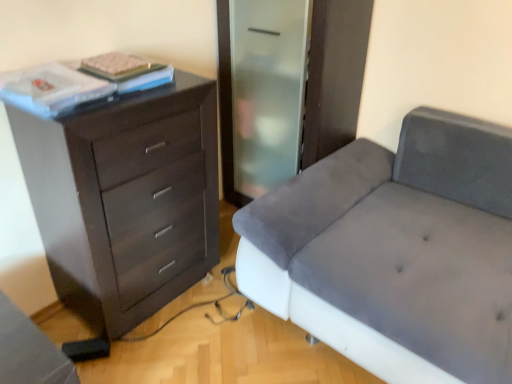
Question: Is velvet grey couch at right looking in the opposite direction of dark wood chest of drawers at left?

Choices:
 (A) yes
 (B) no

Answer: (B)

Question: Considering the relative positions of velvet grey couch at right and dark wood chest of drawers at left in the image provided, is velvet grey couch at right to the left of dark wood chest of drawers at left from the viewer's perspective?

Choices:
 (A) no
 (B) yes

Answer: (A)

Question: From a real-world perspective, is velvet grey couch at right below dark wood chest of drawers at left?

Choices:
 (A) no
 (B) yes

Answer: (B)

Question: Can you confirm if velvet grey couch at right is positioned to the right of dark wood chest of drawers at left?

Choices:
 (A) yes
 (B) no

Answer: (A)

Question: Can you confirm if velvet grey couch at right is thinner than dark wood chest of drawers at left?

Choices:
 (A) yes
 (B) no

Answer: (B)

Question: Can you confirm if velvet grey couch at right is smaller than dark wood chest of drawers at left?

Choices:
 (A) yes
 (B) no

Answer: (B)

Question: Can you confirm if white matte book at upper left is thinner than dark wood chest of drawers at left?

Choices:
 (A) no
 (B) yes

Answer: (B)

Question: Is white matte book at upper left placed right next to dark wood chest of drawers at left?

Choices:
 (A) yes
 (B) no

Answer: (B)

Question: Is white matte book at upper left not near dark wood chest of drawers at left?

Choices:
 (A) no
 (B) yes

Answer: (A)

Question: Considering the relative positions of white matte book at upper left and dark wood chest of drawers at left in the image provided, is white matte book at upper left behind dark wood chest of drawers at left?

Choices:
 (A) no
 (B) yes

Answer: (B)

Question: Does white matte book at upper left have a greater width compared to dark wood chest of drawers at left?

Choices:
 (A) no
 (B) yes

Answer: (A)

Question: Would you say white matte book at upper left contains dark wood chest of drawers at left?

Choices:
 (A) yes
 (B) no

Answer: (B)

Question: Can we say dark wood chest of drawers at left lies outside white matte book at upper left?

Choices:
 (A) no
 (B) yes

Answer: (B)